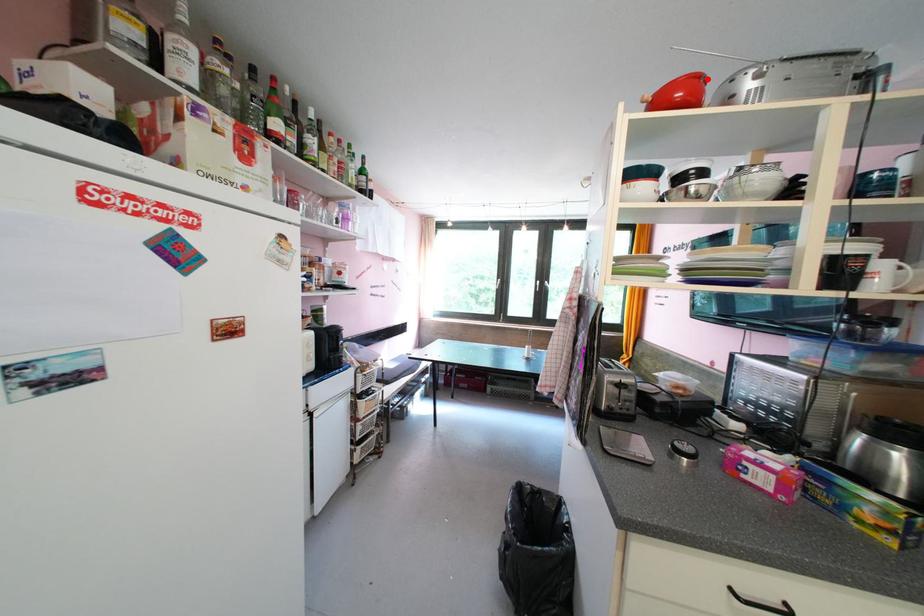
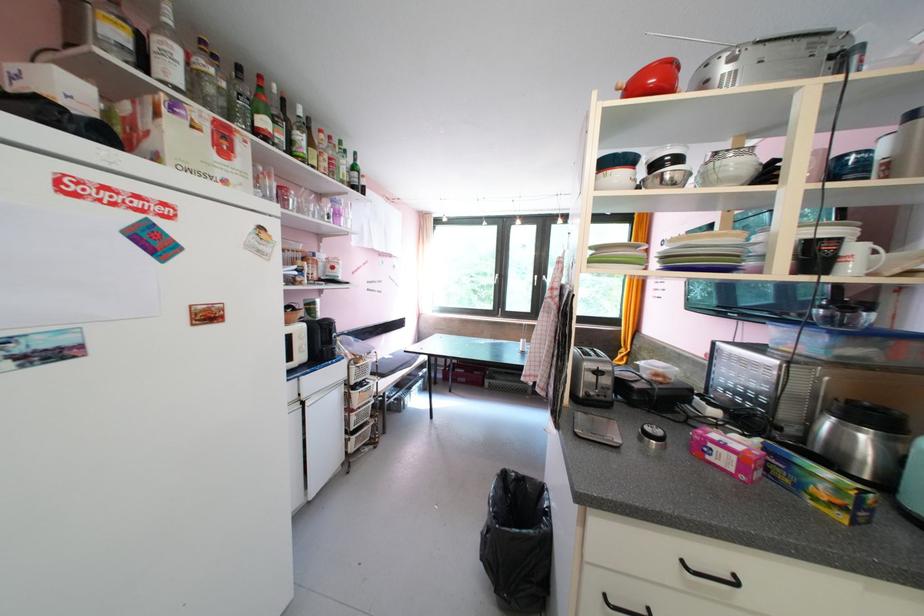
Question: I am providing you with two images of the same scene from different viewpoints. A red point is marked on the first image. At the location where the point appears in image 1, is it still visible in image 2?

Choices:
 (A) Yes
 (B) No

Answer: (A)